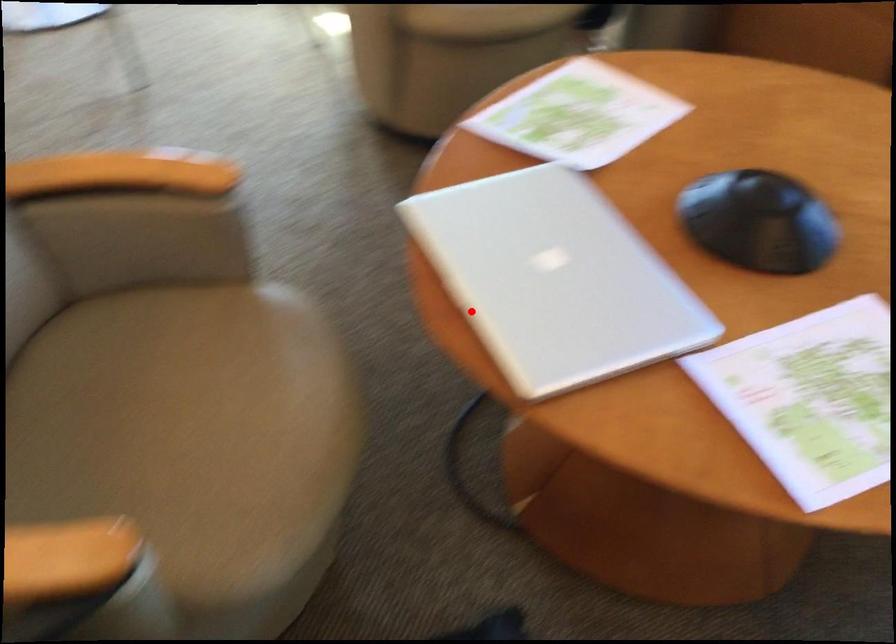
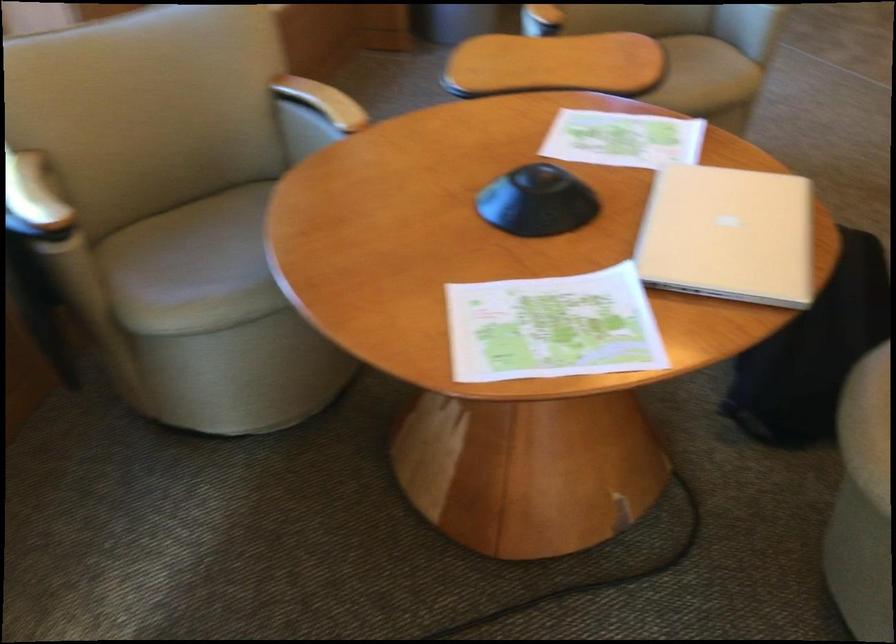
Where in the second image is the point corresponding to the highlighted location from the first image?

(728, 236)